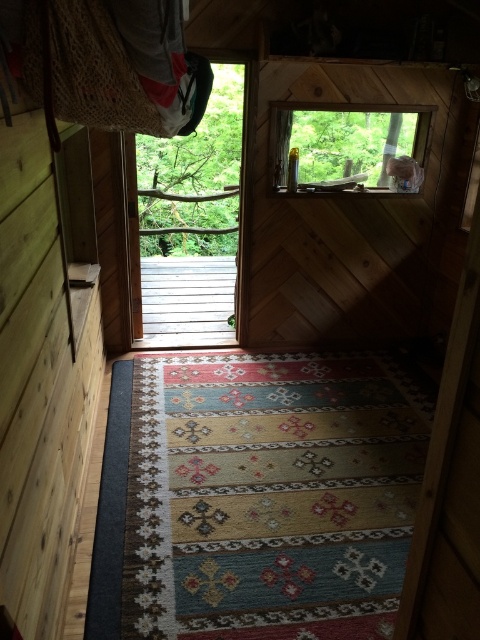
You are a guest staying in the cabin and want to let in more natural light during the day. Which object, the transparent glass door at left or the transparent glass window at upper center, would allow more light into the room based on their sizes?

The transparent glass door at left is much taller than the transparent glass window at upper center, so it would allow more natural light into the room.

You are standing inside the rustic wooden cabin and want to exit to the deck outside. You see the transparent glass door at left and the transparent glass window at upper center. Which one should you use to exit?

You should use the transparent glass door at left to exit because it is closer to you than the transparent glass window at upper center, which is further away.

You are standing inside the cabin and want to exit through the transparent glass door at left. Can you walk through the point at coordinates (190, 220) to exit?

The point at coordinates (190, 220) is on the transparent glass door at left, so yes, you can walk through that point to exit the cabin.